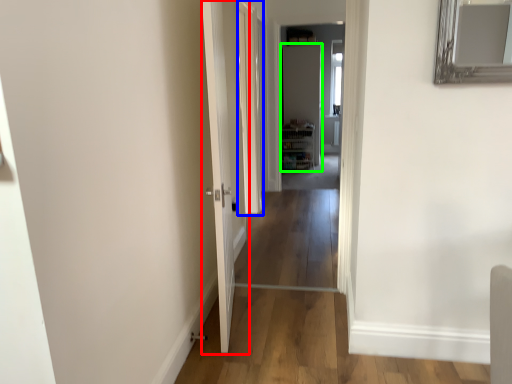
Question: Which object is the closest to the door (highlighted by a red box)? Choose among these: glass door (highlighted by a blue box) or door (highlighted by a green box).

Choices:
 (A) glass door
 (B) door

Answer: (A)